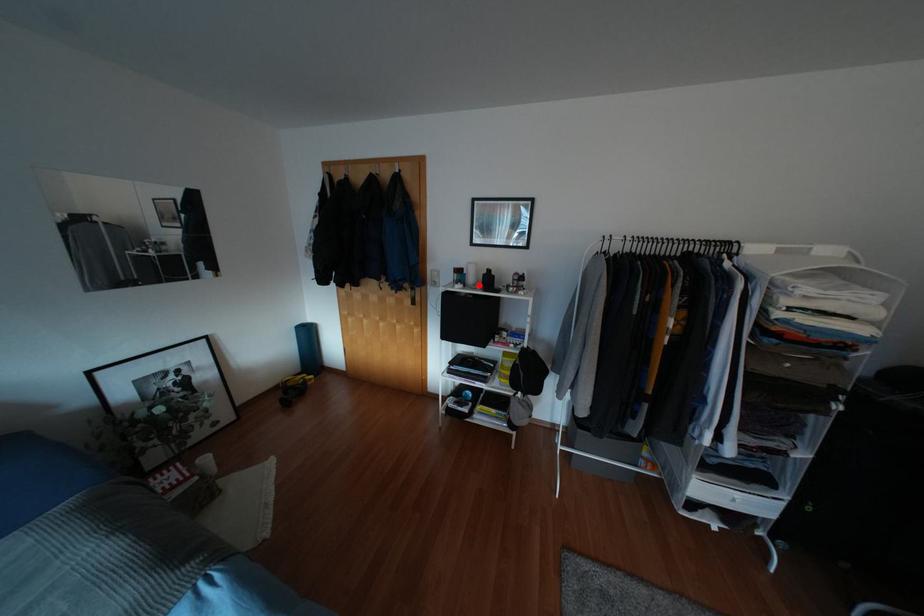
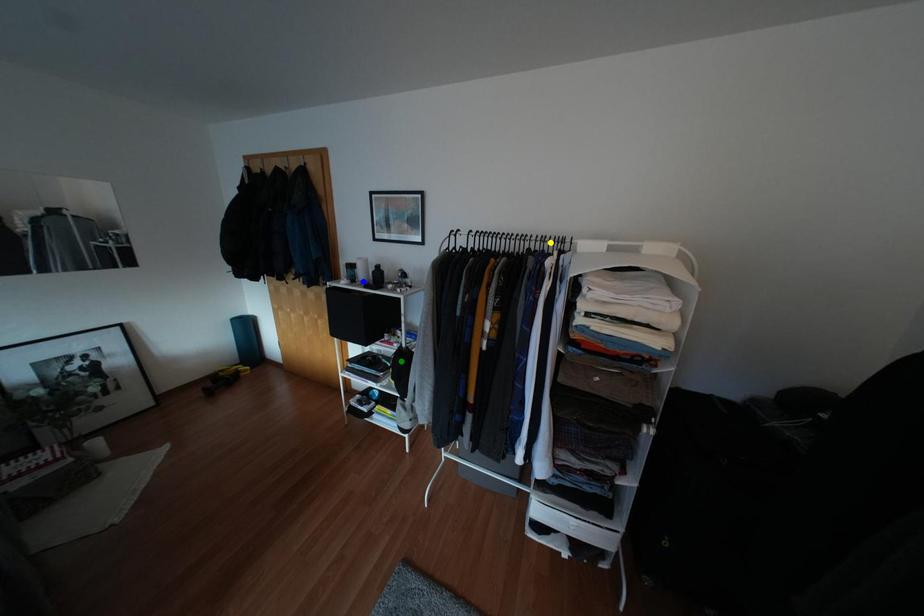
Question: I am providing you with two images of the same scene from different viewpoints. A red point is marked on the first image. You are given multiple points on the second image. Which spot in image 2 lines up with the point in image 1?

Choices:
 (A) yellow point
 (B) blue point
 (C) green point

Answer: (B)